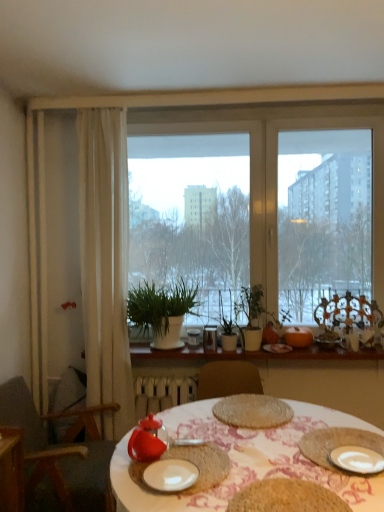
The height and width of the screenshot is (512, 384). Find the location of `vacant space situated above white sheer curtain at left (from a real-world perspective)`. vacant space situated above white sheer curtain at left (from a real-world perspective) is located at coordinates (99, 92).